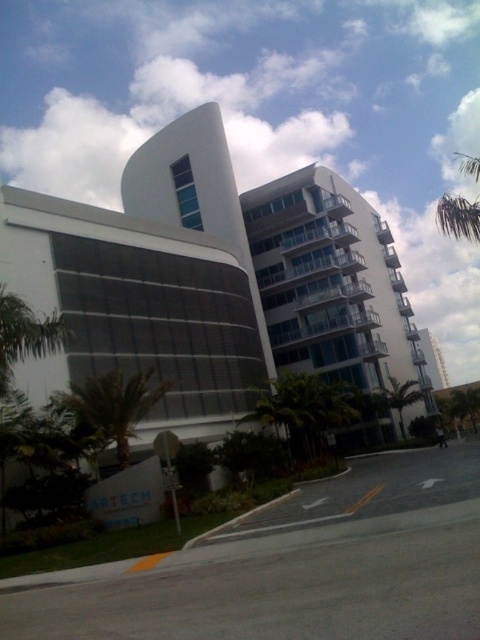
Question: Which point is closer to the camera?

Choices:
 (A) (134, 410)
 (B) (420, 396)
 (C) (289, 182)

Answer: (A)

Question: Is green leafy palm tree at lower left below green leafy palm tree at center-right?

Choices:
 (A) no
 (B) yes

Answer: (A)

Question: Is glassy white balconies at center above green leafy palm tree at lower left?

Choices:
 (A) yes
 (B) no

Answer: (A)

Question: Does glassy white balconies at center appear on the left side of green leafy palm tree at center-right?

Choices:
 (A) no
 (B) yes

Answer: (B)

Question: Which object is closer to the camera taking this photo?

Choices:
 (A) green leafy palm tree at lower left
 (B) glassy white balconies at center

Answer: (A)

Question: Which of the following is the closest to the observer?

Choices:
 (A) (395, 390)
 (B) (334, 236)

Answer: (A)